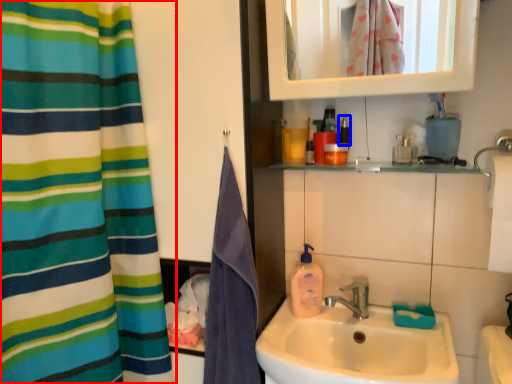
Question: Which object appears closest to the camera in this image, curtain (highlighted by a red box) or mouthwash (highlighted by a blue box)?

Choices:
 (A) curtain
 (B) mouthwash

Answer: (A)